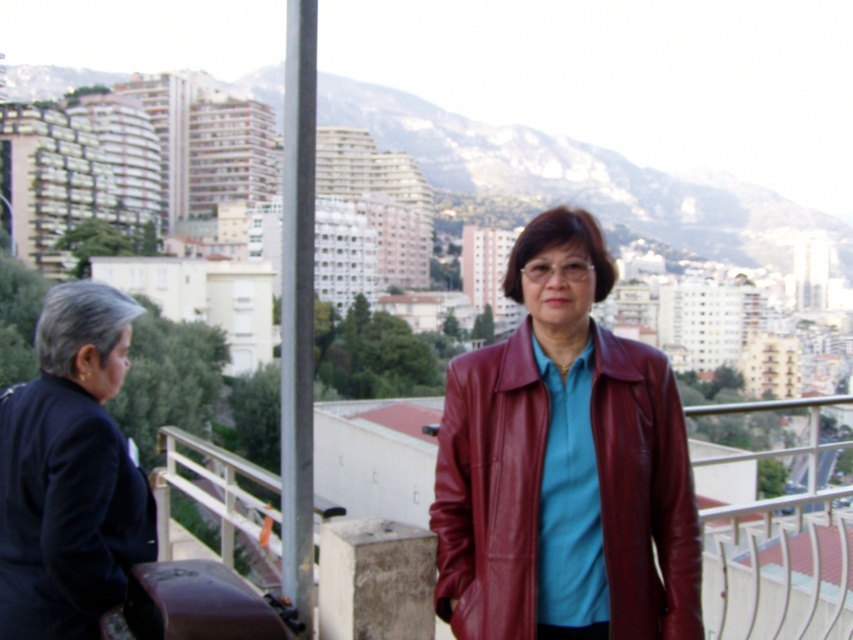
You are an architect designing a new city with a focus on visibility. You need to ensure that the shiny maroon leather jacket at center is visible from a specific observation point. Given its coordinates at point 0.767, 0.576, what is the best way to ensure visibility?

To ensure visibility of the shiny maroon leather jacket at center located at coordinates (490,490), the observation point should be positioned at a higher elevation and facing towards the jacket. This placement will allow unobstructed sightlines while considering the urban and mountainous backdrop.

You are standing on a balcony overlooking a city. You notice two points in the scene. The first point is at coordinates point (527, 369), and the second point is at point (4, 580). Which of these two points is closer to the mountains in the background?

Point (527, 369) is behind point (4, 580), so it is closer to the mountains in the background.